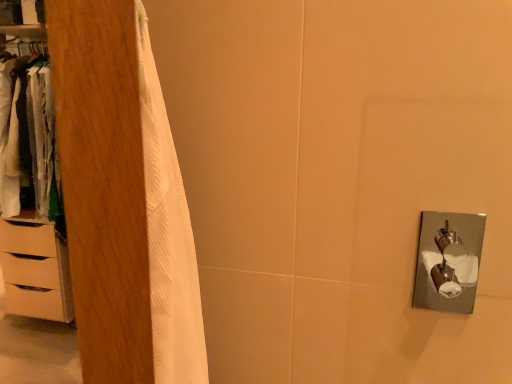
Question: Considering the relative positions of wooden wardrobe at left and white matte chest of drawers at left in the image provided, is wooden wardrobe at left to the right of white matte chest of drawers at left from the viewer's perspective?

Choices:
 (A) yes
 (B) no

Answer: (A)

Question: Is wooden wardrobe at left to the left of white matte chest of drawers at left from the viewer's perspective?

Choices:
 (A) yes
 (B) no

Answer: (B)

Question: From a real-world perspective, is wooden wardrobe at left physically above white matte chest of drawers at left?

Choices:
 (A) no
 (B) yes

Answer: (B)

Question: Could you tell me if wooden wardrobe at left is facing white matte chest of drawers at left?

Choices:
 (A) no
 (B) yes

Answer: (A)

Question: From a real-world perspective, is wooden wardrobe at left physically below white matte chest of drawers at left?

Choices:
 (A) no
 (B) yes

Answer: (A)

Question: Visually, is white wood dresser at left positioned to the left or to the right of wooden wardrobe at left?

Choices:
 (A) left
 (B) right

Answer: (A)

Question: Considering the positions of point (47, 304) and point (105, 340), is point (47, 304) closer or farther from the camera than point (105, 340)?

Choices:
 (A) farther
 (B) closer

Answer: (A)

Question: Looking at the image, does white wood dresser at left seem bigger or smaller compared to wooden wardrobe at left?

Choices:
 (A) big
 (B) small

Answer: (A)

Question: Is white wood dresser at left spatially inside wooden wardrobe at left, or outside of it?

Choices:
 (A) inside
 (B) outside

Answer: (B)

Question: Is white wood dresser at left spatially inside white matte chest of drawers at left, or outside of it?

Choices:
 (A) outside
 (B) inside

Answer: (A)

Question: Considering the positions of white wood dresser at left and white matte chest of drawers at left in the image, is white wood dresser at left wider or thinner than white matte chest of drawers at left?

Choices:
 (A) thin
 (B) wide

Answer: (A)

Question: From the image's perspective, is white wood dresser at left located above or below white matte chest of drawers at left?

Choices:
 (A) below
 (B) above

Answer: (B)

Question: In the image, is white wood dresser at left positioned in front of or behind white matte chest of drawers at left?

Choices:
 (A) front
 (B) behind

Answer: (A)

Question: In the image, is wooden wardrobe at left positioned in front of or behind white matte chest of drawers at left?

Choices:
 (A) behind
 (B) front

Answer: (B)

Question: In terms of width, does wooden wardrobe at left look wider or thinner when compared to white matte chest of drawers at left?

Choices:
 (A) thin
 (B) wide

Answer: (A)